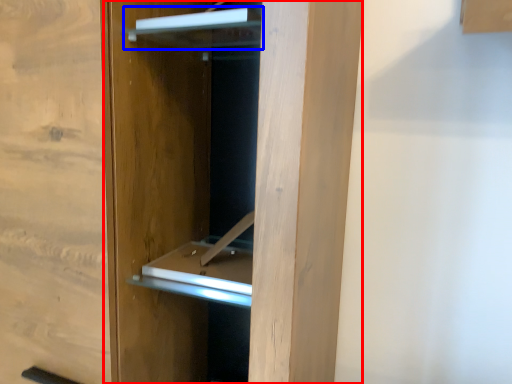
Question: Which object appears farthest to the camera in this image, door (highlighted by a red box) or cabinet (highlighted by a blue box)?

Choices:
 (A) door
 (B) cabinet

Answer: (B)